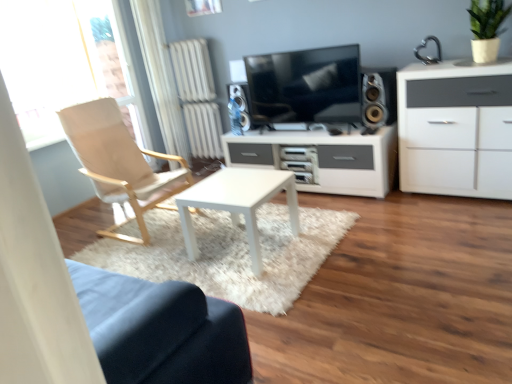
Where is `unoccupied region to the right of white matte coffee table at center`? The image size is (512, 384). unoccupied region to the right of white matte coffee table at center is located at coordinates (307, 237).